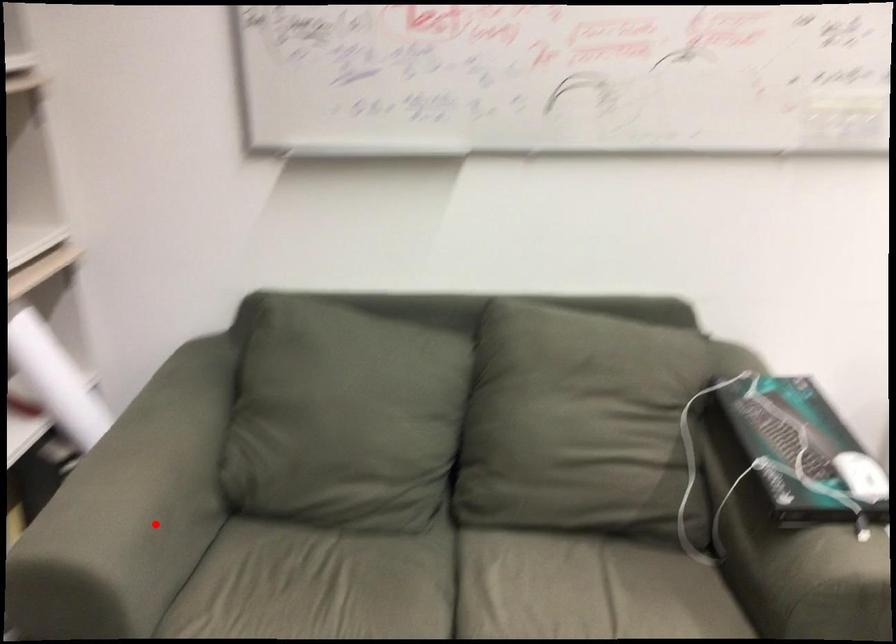
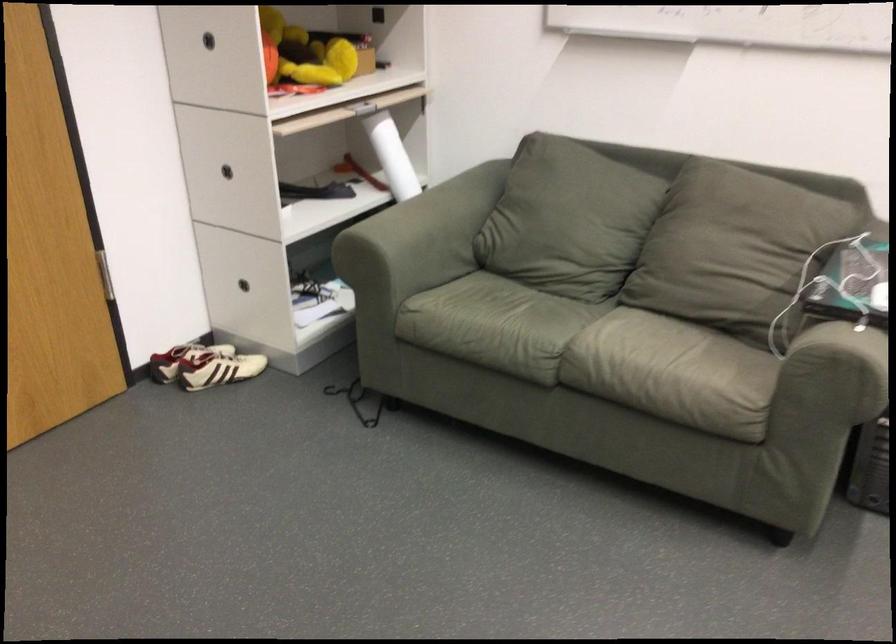
Question: I am providing you with two images of the same scene from different viewpoints. Given a red point in image1, look at the same physical point in image2. Is it:

Choices:
 (A) Closer to the viewpoint
 (B) Farther from the viewpoint

Answer: (B)